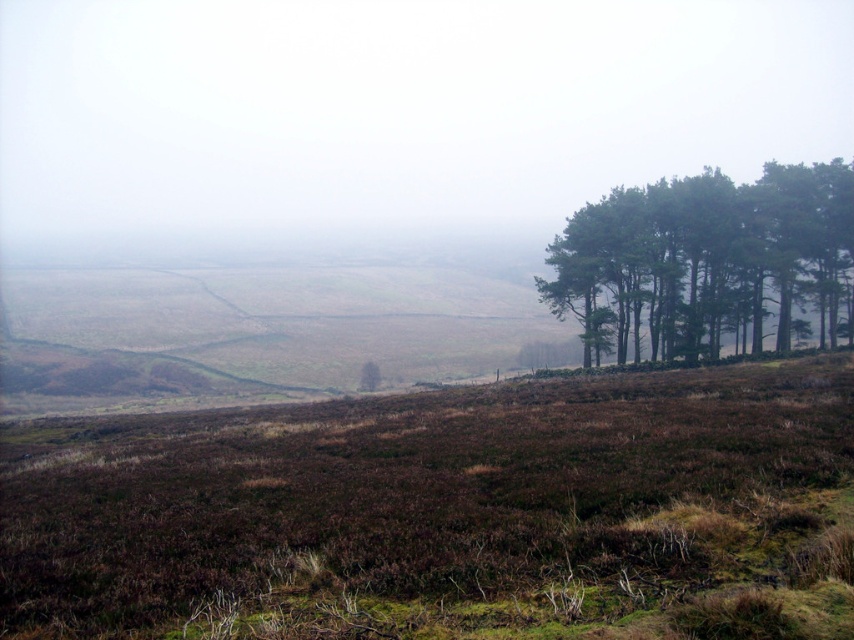
Can you confirm if brown/dry grass at center is smaller than green matte trees at right?

Actually, brown/dry grass at center might be larger than green matte trees at right.

Does brown/dry grass at center appear under green matte trees at right?

Yes, brown/dry grass at center is below green matte trees at right.

Based on the photo, who is more distant from viewer, (340, 579) or (788, 208)?

Point (788, 208)

Image resolution: width=854 pixels, height=640 pixels. Identify the location of brown/dry grass at center. (447, 513).